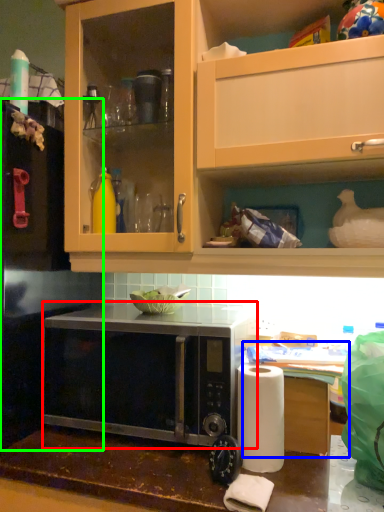
Question: Which object is positioned farthest from microwave oven (highlighted by a red box)? Select from table (highlighted by a blue box) and appliance (highlighted by a green box).

Choices:
 (A) table
 (B) appliance

Answer: (A)